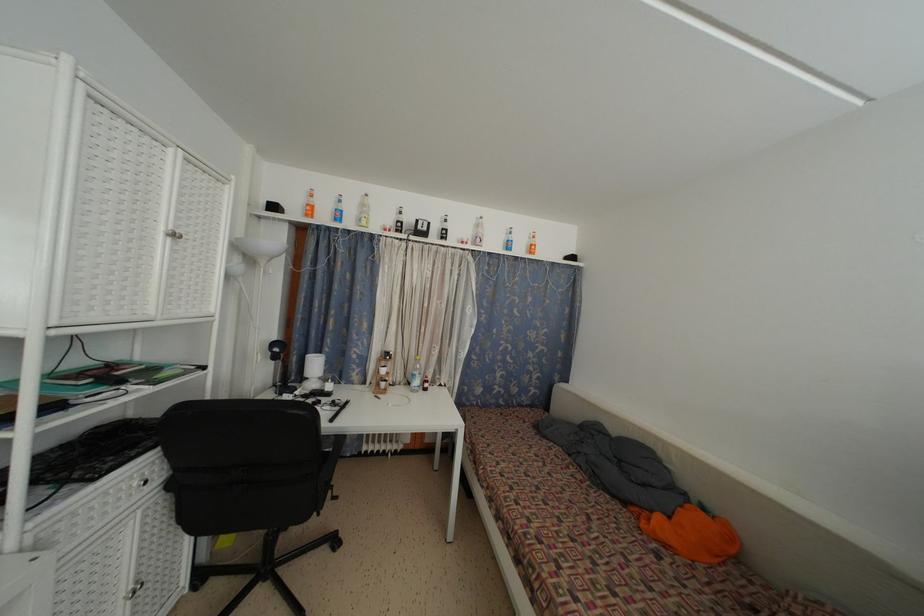
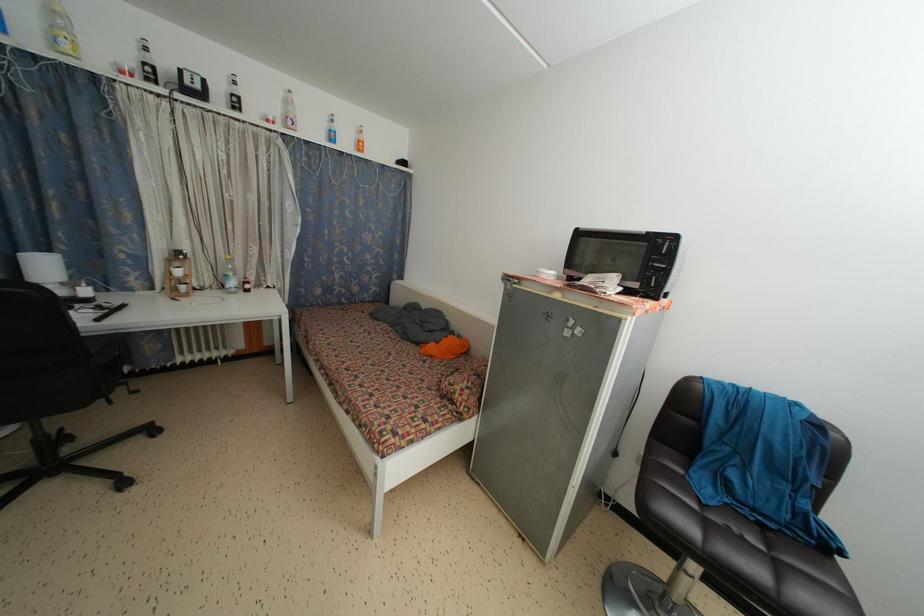
Locate, in the second image, the point that corresponds to pixel 402 227 in the first image.

(149, 70)